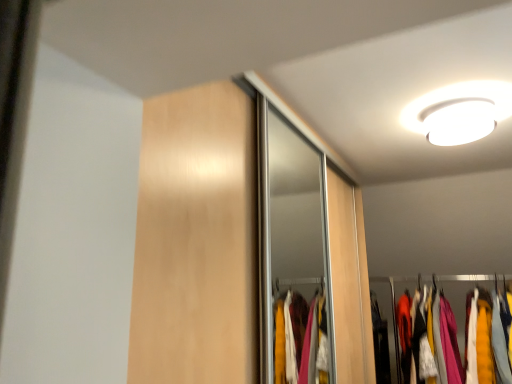
Measure the distance between point (432, 103) and camera.

The depth of point (432, 103) is 1.79 meters.

What do you see at coordinates (459, 111) in the screenshot? Image resolution: width=512 pixels, height=384 pixels. I see `white glossy light fixture at upper right` at bounding box center [459, 111].

Where is `white glossy light fixture at upper right`? white glossy light fixture at upper right is located at coordinates (459, 111).

At what (x,y) coordinates should I click in order to perform the action: click on white glossy light fixture at upper right. Please return your answer as a coordinate pair (x, y). Looking at the image, I should click on (459, 111).